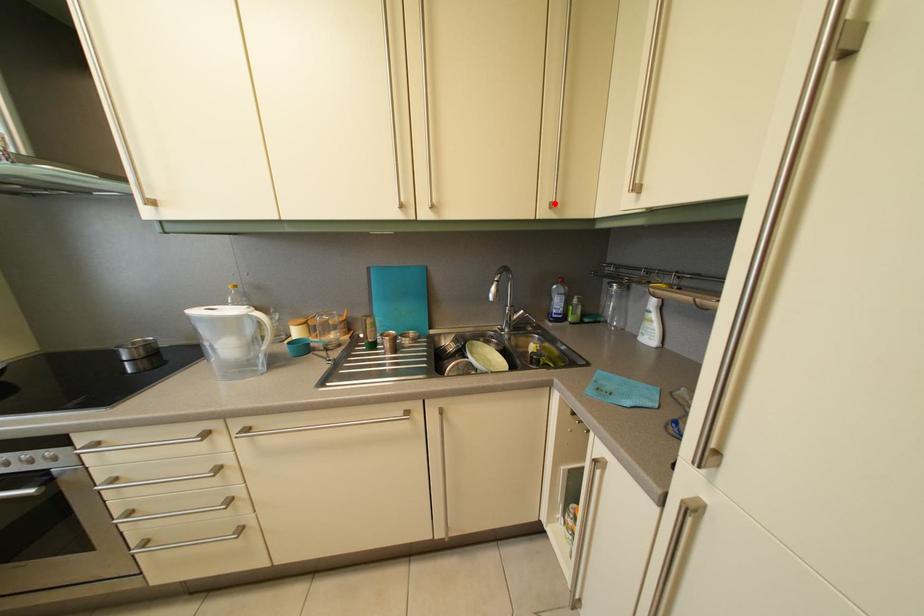
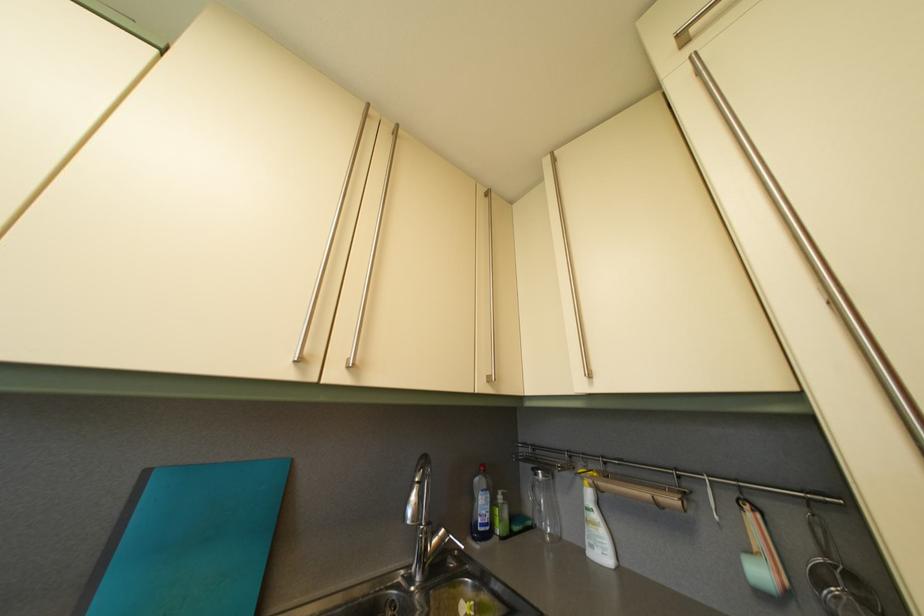
Question: I am providing you with two images of the same scene from different viewpoints. A red point is marked on the first image. Is the red point's position out of view in image 2?

Choices:
 (A) Yes
 (B) No

Answer: (B)